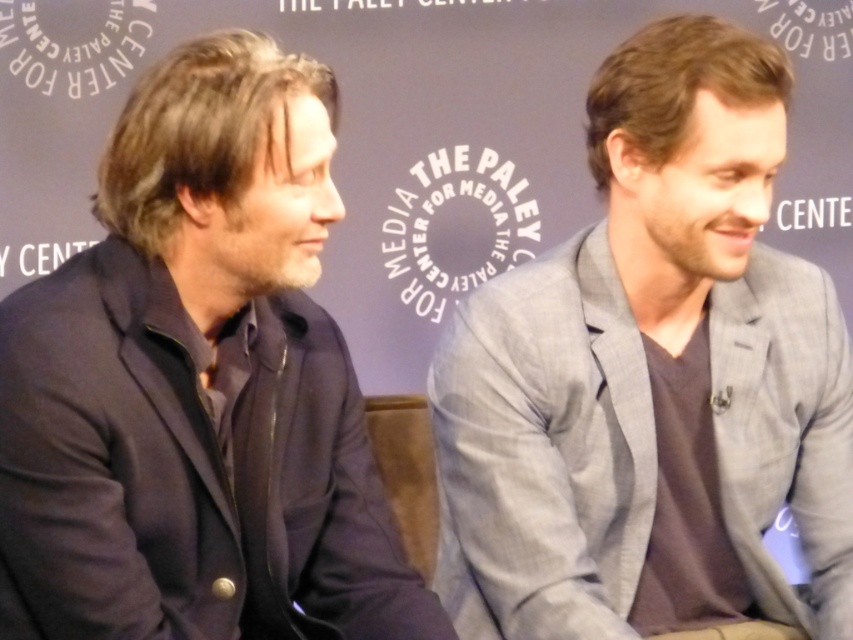
Is gray textured blazer at center taller than dark blue suit at left?

Correct, gray textured blazer at center is much taller as dark blue suit at left.

Can you confirm if gray textured blazer at center is positioned above dark blue suit at left?

No.

What do you see at coordinates (651, 378) in the screenshot? The height and width of the screenshot is (640, 853). I see `gray textured blazer at center` at bounding box center [651, 378].

Image resolution: width=853 pixels, height=640 pixels. Find the location of `gray textured blazer at center`. gray textured blazer at center is located at coordinates (651, 378).